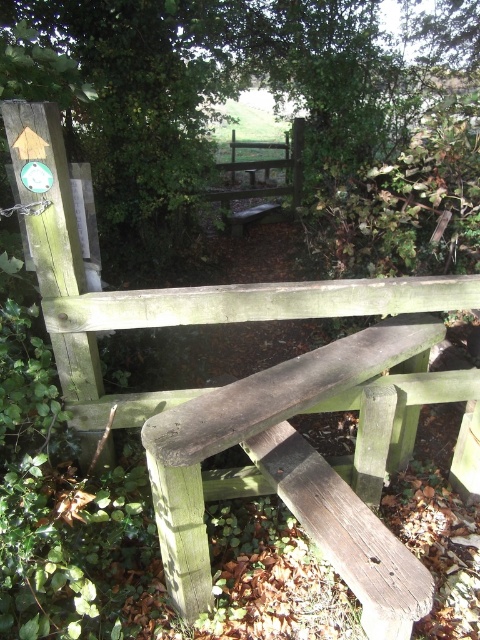
Question: From the image, what is the correct spatial relationship of green leafy tree at upper left in relation to dark brown wood bench at center?

Choices:
 (A) below
 (B) above

Answer: (B)

Question: Which point appears closest to the camera in this image?

Choices:
 (A) (274, 52)
 (B) (181, 547)

Answer: (B)

Question: Which point appears closest to the camera in this image?

Choices:
 (A) (444, 44)
 (B) (230, 394)

Answer: (B)

Question: Is green leafy tree at upper left smaller than dark brown wood bench at center?

Choices:
 (A) no
 (B) yes

Answer: (A)

Question: Does green leafy tree at upper left appear over dark brown wood bench at center?

Choices:
 (A) no
 (B) yes

Answer: (B)